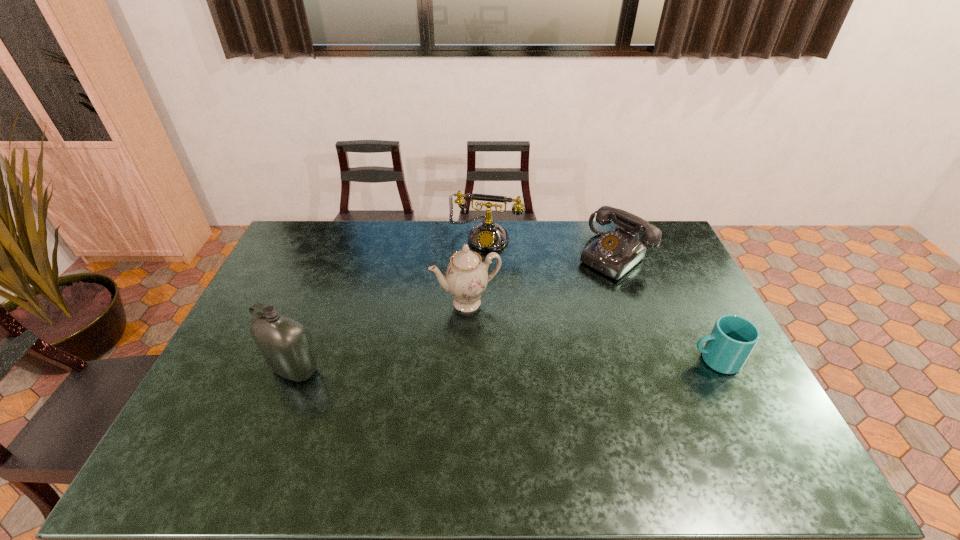
Image resolution: width=960 pixels, height=540 pixels. Find the location of `vacant region between the fourth tallest object and the taller telephone`. vacant region between the fourth tallest object and the taller telephone is located at coordinates (549, 246).

Identify the location of unoccupied area between the bottle and the chinaware. (381, 336).

Image resolution: width=960 pixels, height=540 pixels. Identify the location of free area in between the right telephone and the bottle. (454, 313).

I want to click on blank region between the bottle and the right telephone, so click(454, 313).

Find the location of a particular element. The image size is (960, 540). vacant area that lies between the leftmost object and the left telephone is located at coordinates (390, 302).

Image resolution: width=960 pixels, height=540 pixels. Identify the location of free space between the cup and the right telephone. (664, 308).

The image size is (960, 540). I want to click on the fourth closest object to the cup, so click(x=284, y=342).

This screenshot has height=540, width=960. Find the location of `object that stands as the closest to the leftmost object`. object that stands as the closest to the leftmost object is located at coordinates (466, 277).